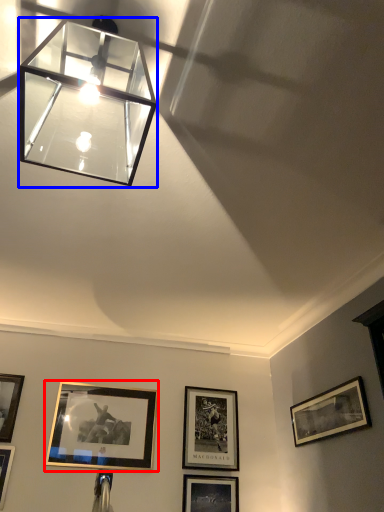
Question: Which point is closer to the camera, picture frame (highlighted by a red box) or lamp (highlighted by a blue box)?

Choices:
 (A) picture frame
 (B) lamp

Answer: (B)